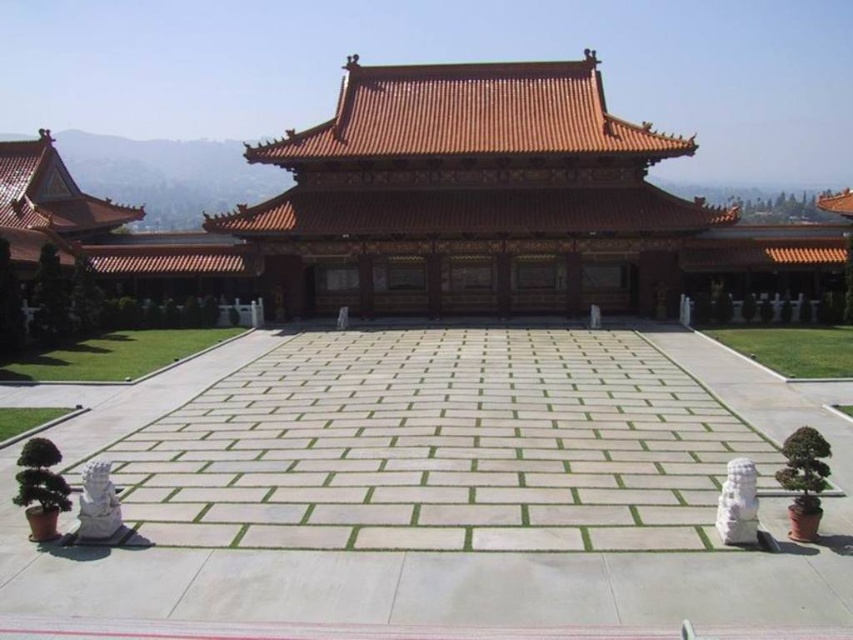
You are standing at the entrance of the traditional East Asian architectural structure and want to walk to the green grass at lower left. Based on the coordinates provided in the Objects Description, can you determine the direction you should walk to reach it?

The green grass at lower left is located at point (115, 355), which means it is positioned to the lower left side of the scene. To reach it, you should walk towards the lower left direction from the entrance.

You are standing in front of the temple and want to place a small statue on the paved area between the green grass at lower right and the green leafy plant at lower left. Based on their positions, where should you place the statue so it is between both plants?

The green grass at lower right is located above the green leafy plant at lower left, so placing the statue between them would require positioning it below the green grass at lower right and above the green leafy plant at lower left.

You are standing in front of the brown wooden palace at center and want to walk towards the green grass at lower left. Which direction should you move relative to the palace?

The brown wooden palace at center is positioned on the right side of green grass at lower left, so you should move to the left relative to the palace to reach the green grass at lower left.